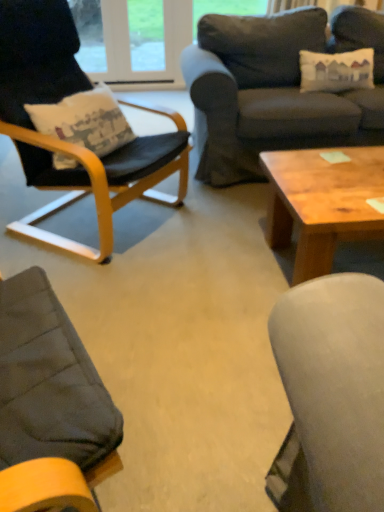
At what (x,y) coordinates should I click in order to perform the action: click on vacant area that lies to the right of black leather chair at left. Please return your answer as a coordinate pair (x, y). Image resolution: width=384 pixels, height=512 pixels. Looking at the image, I should click on (218, 234).